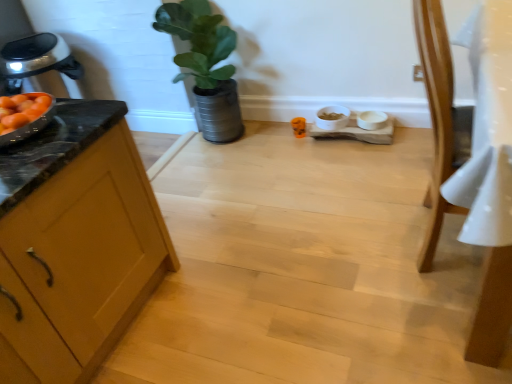
Question: Should I look upward or downward to see wooden cabinet at left?

Choices:
 (A) down
 (B) up

Answer: (A)

Question: Is green matte plant at upper center turned away from wooden cabinet at left?

Choices:
 (A) no
 (B) yes

Answer: (A)

Question: From a real-world perspective, is green matte plant at upper center on wooden cabinet at left?

Choices:
 (A) no
 (B) yes

Answer: (B)

Question: Is green matte plant at upper center behind wooden cabinet at left?

Choices:
 (A) yes
 (B) no

Answer: (A)

Question: Is the surface of green matte plant at upper center in direct contact with wooden cabinet at left?

Choices:
 (A) yes
 (B) no

Answer: (B)

Question: Can you confirm if green matte plant at upper center is shorter than wooden cabinet at left?

Choices:
 (A) yes
 (B) no

Answer: (B)

Question: Could you tell me if green matte plant at upper center is turned towards wooden cabinet at left?

Choices:
 (A) no
 (B) yes

Answer: (B)

Question: Does light brown wooden chair at right appear on the right side of green matte plant at upper center?

Choices:
 (A) yes
 (B) no

Answer: (A)

Question: Is light brown wooden chair at right positioned with its back to green matte plant at upper center?

Choices:
 (A) yes
 (B) no

Answer: (B)

Question: Is light brown wooden chair at right far from green matte plant at upper center?

Choices:
 (A) no
 (B) yes

Answer: (B)

Question: Can you confirm if light brown wooden chair at right is bigger than green matte plant at upper center?

Choices:
 (A) no
 (B) yes

Answer: (B)

Question: Can we say light brown wooden chair at right lies outside green matte plant at upper center?

Choices:
 (A) yes
 (B) no

Answer: (A)

Question: From a real-world perspective, does light brown wooden chair at right sit lower than green matte plant at upper center?

Choices:
 (A) no
 (B) yes

Answer: (A)

Question: Is light brown wooden chair at right closer to the viewer compared to wooden cabinet at left?

Choices:
 (A) yes
 (B) no

Answer: (B)